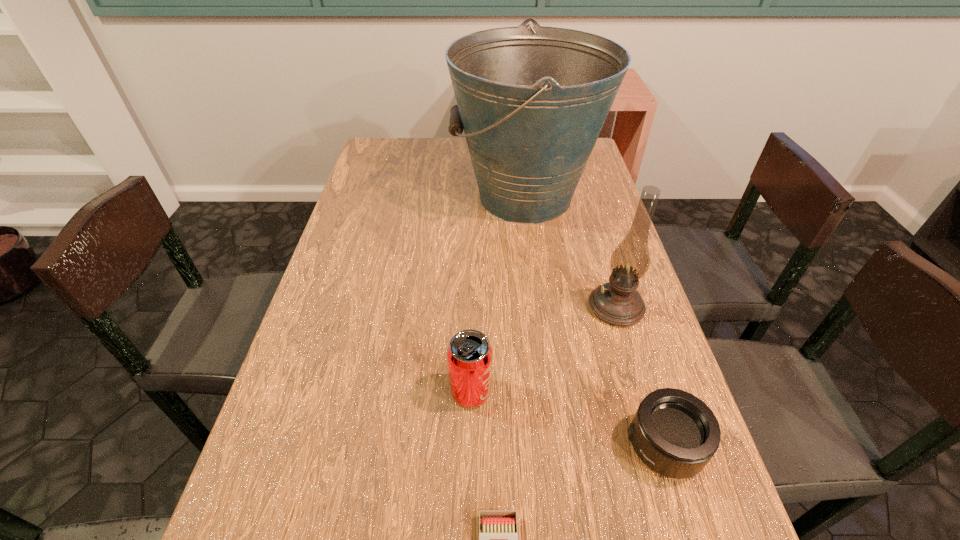
You are a GUI agent. You are given a task and a screenshot of the screen. Output one action in this format:
    pyautogui.click(x=<x>, y=<y>)
    Task: Click on the free space between the second shortest object and the farthest object
    The image size is (960, 540).
    Given the screenshot: What is the action you would take?
    pyautogui.click(x=594, y=321)

In order to click on vacant area between the oil lamp and the telephoto lens in this screenshot , I will do `click(640, 376)`.

Where is `free space between the third shortest object and the oil lamp`? The width and height of the screenshot is (960, 540). free space between the third shortest object and the oil lamp is located at coordinates (543, 349).

The height and width of the screenshot is (540, 960). What are the coordinates of `object that ranks as the third closest to the nearest object` in the screenshot? It's located at (618, 303).

I want to click on object that stands as the third closest to the oil lamp, so click(x=469, y=354).

Locate an element on the screen. The width and height of the screenshot is (960, 540). vacant position in the image that satisfies the following two spatial constraints: 1. with the handle on opposite sides of the second tallest object; 2. on the right side of the farthest object is located at coordinates (540, 307).